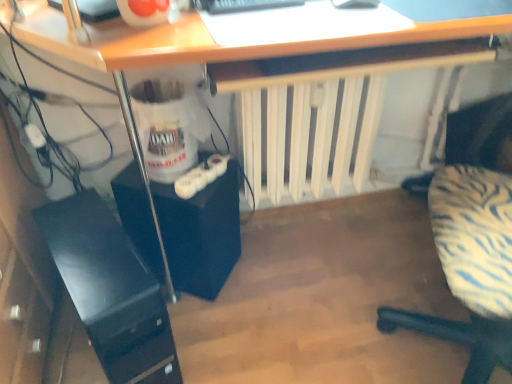
What is the approximate height of zebra-patterned fabric chair at right?

The height of zebra-patterned fabric chair at right is 39.10 inches.

In order to face zebra-patterned fabric chair at right, should I rotate leftwards or rightwards?

Turn right approximately 32.509 degrees to face it.

This screenshot has width=512, height=384. What do you see at coordinates (201, 233) in the screenshot? I see `black matte computer tower at lower left, the second computer tower in the left-to-right sequence` at bounding box center [201, 233].

The height and width of the screenshot is (384, 512). Find the location of `black glossy computer tower at lower left, which is the first computer tower in left-to-right order`. black glossy computer tower at lower left, which is the first computer tower in left-to-right order is located at coordinates (111, 290).

Between black glossy computer tower at lower left, which is the second computer tower from right to left, and white matte radiator at center, which one has larger width?

black glossy computer tower at lower left, which is the second computer tower from right to left, is wider.

Does black glossy computer tower at lower left, which is the first computer tower in left-to-right order, appear on the right side of white matte radiator at center?

Incorrect, black glossy computer tower at lower left, which is the first computer tower in left-to-right order, is not on the right side of white matte radiator at center.

How distant is black glossy computer tower at lower left, which is the second computer tower from right to left, from white matte radiator at center?

black glossy computer tower at lower left, which is the second computer tower from right to left, and white matte radiator at center are 63.68 centimeters apart from each other.

Which is in front, black glossy computer tower at lower left, which is the first computer tower in left-to-right order, or white matte radiator at center?

black glossy computer tower at lower left, which is the first computer tower in left-to-right order, is in front.

Is white matte radiator at center surrounding black matte computer tower at lower left, the second computer tower in the left-to-right sequence?

No, black matte computer tower at lower left, the second computer tower in the left-to-right sequence, is not surrounded by white matte radiator at center.

Considering the sizes of objects white matte radiator at center and black matte computer tower at lower left, the second computer tower in the left-to-right sequence, in the image provided, who is bigger, white matte radiator at center or black matte computer tower at lower left, the second computer tower in the left-to-right sequence,?

white matte radiator at center.

How different are the orientations of white matte radiator at center and black matte computer tower at lower left, the second computer tower in the left-to-right sequence, in degrees?

The facing directions of white matte radiator at center and black matte computer tower at lower left, the second computer tower in the left-to-right sequence, are 49.9 degrees apart.

Is white matte radiator at center at the left side of black matte computer tower at lower left, the 1th computer tower viewed from the right?

No, white matte radiator at center is not to the left of black matte computer tower at lower left, the 1th computer tower viewed from the right.

Is point (326, 128) farther from camera compared to point (413, 186)?

No, it is in front of (413, 186).

Can you tell me how much white matte radiator at center and zebra-patterned fabric chair at right differ in facing direction?

There is a 116-degree angle between the facing directions of white matte radiator at center and zebra-patterned fabric chair at right.

Are white matte radiator at center and zebra-patterned fabric chair at right far apart?

white matte radiator at center is actually quite close to zebra-patterned fabric chair at right.

Can you confirm if white matte radiator at center is positioned to the right of zebra-patterned fabric chair at right?

No.

In the image, is black matte computer tower at lower left, the second computer tower in the left-to-right sequence, positioned in front of or behind black glossy computer tower at lower left, which is the first computer tower in left-to-right order?

black matte computer tower at lower left, the second computer tower in the left-to-right sequence, is positioned farther from the viewer than black glossy computer tower at lower left, which is the first computer tower in left-to-right order.

In terms of height, does black matte computer tower at lower left, the 1th computer tower viewed from the right, look taller or shorter compared to black glossy computer tower at lower left, which is the first computer tower in left-to-right order?

Clearly, black matte computer tower at lower left, the 1th computer tower viewed from the right, is shorter compared to black glossy computer tower at lower left, which is the first computer tower in left-to-right order.

Which object is positioned more to the right, black matte computer tower at lower left, the 1th computer tower viewed from the right, or black glossy computer tower at lower left, which is the first computer tower in left-to-right order?

black matte computer tower at lower left, the 1th computer tower viewed from the right.

From the image's perspective, is black matte computer tower at lower left, the second computer tower in the left-to-right sequence, above black glossy computer tower at lower left, which is the first computer tower in left-to-right order?

Yes.

What's the angular difference between black matte computer tower at lower left, the 1th computer tower viewed from the right, and zebra-patterned fabric chair at right's facing directions?

165 degrees separate the facing orientations of black matte computer tower at lower left, the 1th computer tower viewed from the right, and zebra-patterned fabric chair at right.

Do you think black matte computer tower at lower left, the 1th computer tower viewed from the right, is within zebra-patterned fabric chair at right, or outside of it?

black matte computer tower at lower left, the 1th computer tower viewed from the right, is located beyond the bounds of zebra-patterned fabric chair at right.

Where is `chair above the black matte computer tower at lower left, the 1th computer tower viewed from the right (from the image's perspective)`? This screenshot has height=384, width=512. chair above the black matte computer tower at lower left, the 1th computer tower viewed from the right (from the image's perspective) is located at coordinates (460, 338).

Who is shorter, black matte computer tower at lower left, the 1th computer tower viewed from the right, or zebra-patterned fabric chair at right?

With less height is black matte computer tower at lower left, the 1th computer tower viewed from the right.

Between black glossy computer tower at lower left, which is the second computer tower from right to left, and black matte computer tower at lower left, the 1th computer tower viewed from the right, which one is positioned behind?

black matte computer tower at lower left, the 1th computer tower viewed from the right, is behind.

Would you say black glossy computer tower at lower left, which is the second computer tower from right to left, contains black matte computer tower at lower left, the second computer tower in the left-to-right sequence?

No.

Which is more to the right, black glossy computer tower at lower left, which is the first computer tower in left-to-right order, or black matte computer tower at lower left, the 1th computer tower viewed from the right?

black matte computer tower at lower left, the 1th computer tower viewed from the right.

Between point (438, 328) and point (254, 143), which one is positioned behind?

Point (254, 143)

Considering their positions, is zebra-patterned fabric chair at right located in front of or behind white matte radiator at center?

zebra-patterned fabric chair at right is positioned closer to the viewer than white matte radiator at center.

Where is `radiator on the right of black glossy computer tower at lower left, which is the first computer tower in left-to-right order`? radiator on the right of black glossy computer tower at lower left, which is the first computer tower in left-to-right order is located at coordinates [266, 140].

From the image's perspective, which computer tower is the 1st one below the white matte radiator at center? Please provide its 2D coordinates.

[(201, 233)]

Considering their positions, is black glossy computer tower at lower left, which is the first computer tower in left-to-right order, positioned closer to white matte radiator at center than zebra-patterned fabric chair at right?

zebra-patterned fabric chair at right.

From the image, which object appears to be farther from white matte radiator at center, zebra-patterned fabric chair at right or black matte computer tower at lower left, the 1th computer tower viewed from the right?

zebra-patterned fabric chair at right.

When comparing their distances from black glossy computer tower at lower left, which is the second computer tower from right to left, does white matte radiator at center or zebra-patterned fabric chair at right seem further?

Based on the image, zebra-patterned fabric chair at right appears to be further to black glossy computer tower at lower left, which is the second computer tower from right to left.

Looking at the image, which one is located closer to black glossy computer tower at lower left, which is the first computer tower in left-to-right order, zebra-patterned fabric chair at right or black matte computer tower at lower left, the 1th computer tower viewed from the right?

Based on the image, black matte computer tower at lower left, the 1th computer tower viewed from the right, appears to be nearer to black glossy computer tower at lower left, which is the first computer tower in left-to-right order.

Based on their spatial positions, is zebra-patterned fabric chair at right or black glossy computer tower at lower left, which is the first computer tower in left-to-right order, closer to white matte radiator at center?

The object closer to white matte radiator at center is zebra-patterned fabric chair at right.

Looking at the image, which one is located further to zebra-patterned fabric chair at right, white matte radiator at center or black glossy computer tower at lower left, which is the second computer tower from right to left?

black glossy computer tower at lower left, which is the second computer tower from right to left, lies further to zebra-patterned fabric chair at right than the other object.

When comparing their distances from black glossy computer tower at lower left, which is the second computer tower from right to left, does white matte radiator at center or black matte computer tower at lower left, the second computer tower in the left-to-right sequence, seem further?

white matte radiator at center is positioned further to the anchor black glossy computer tower at lower left, which is the second computer tower from right to left.

From the image, which object appears to be nearer to zebra-patterned fabric chair at right, black matte computer tower at lower left, the 1th computer tower viewed from the right, or black glossy computer tower at lower left, which is the second computer tower from right to left?

black matte computer tower at lower left, the 1th computer tower viewed from the right, lies closer to zebra-patterned fabric chair at right than the other object.

The image size is (512, 384). Identify the location of radiator positioned between zebra-patterned fabric chair at right and black matte computer tower at lower left, the second computer tower in the left-to-right sequence, from near to far. (266, 140).

Locate an element on the screen. computer tower between black glossy computer tower at lower left, which is the first computer tower in left-to-right order, and zebra-patterned fabric chair at right is located at coordinates (201, 233).

The height and width of the screenshot is (384, 512). In order to click on radiator between black glossy computer tower at lower left, which is the second computer tower from right to left, and zebra-patterned fabric chair at right from left to right in this screenshot , I will do `click(266, 140)`.

Identify the location of computer tower between black glossy computer tower at lower left, which is the first computer tower in left-to-right order, and white matte radiator at center, in the horizontal direction. The image size is (512, 384). (201, 233).